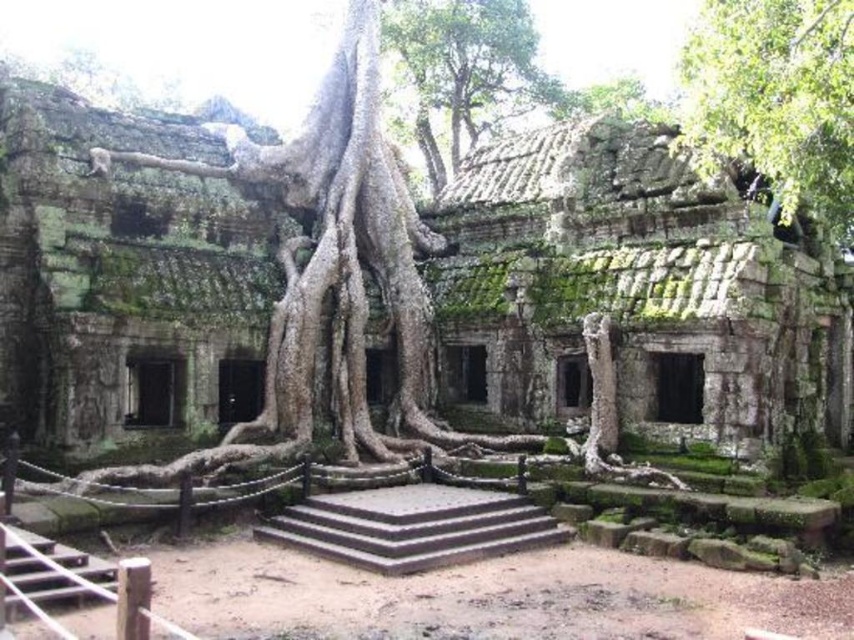
You are standing in front of the ancient stone structure and notice two points marked on the wall. The first point is at coordinates point (797, 198) and the second is at point (448, 44). If you were to throw a small pebble towards these points, which point would the pebble hit first?

The pebble would hit point (797, 198) first because it is closer to the camera than point (448, 44).

You are standing at the point marked as point (589, 273) in the image. What structure are you currently positioned on?

You are currently positioned on the green mossy stone ruins at center, which is represented by point (589, 273).